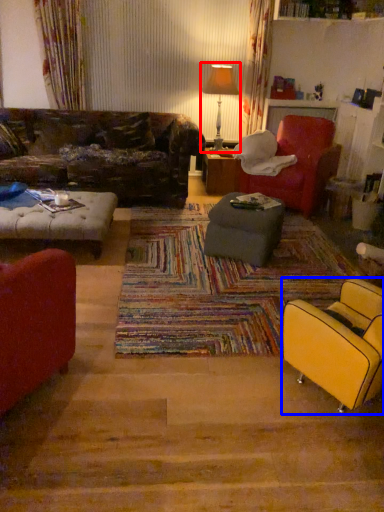
Question: Which point is further to the camera, lamp (highlighted by a red box) or chair (highlighted by a blue box)?

Choices:
 (A) lamp
 (B) chair

Answer: (A)